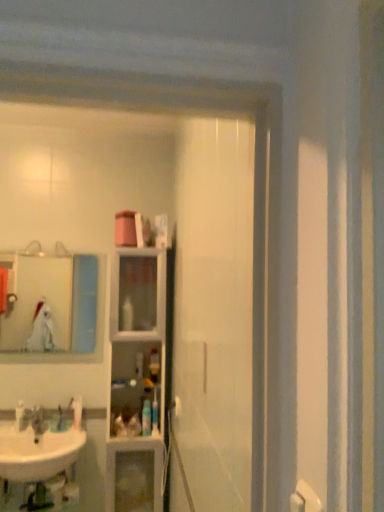
In the scene shown: What is the approximate height of white glossy sink at lower left?

7.51 inches.

Image resolution: width=384 pixels, height=512 pixels. What are the coordinates of `matte glass mirror at upper left` in the screenshot? It's located at (37, 300).

Consider the image. Is white glossy toothpaste tube at center, the second toiletry from the left, inside the boundaries of translucent plastic bottle at center, the 4th toiletry positioned from the left, or outside?

white glossy toothpaste tube at center, the second toiletry from the left, lies outside translucent plastic bottle at center, the 4th toiletry positioned from the left.

Based on the photo, how distant is white glossy toothpaste tube at center, the 4th toiletry when ordered from right to left, from translucent plastic bottle at center, which is the 2th toiletry in right-to-left order?

They are 19.48 inches apart.

From the image's perspective, would you say white glossy toothpaste tube at center, the 4th toiletry when ordered from right to left, is shown under translucent plastic bottle at center, which is the 2th toiletry in right-to-left order?

Yes.

Is white glossy toothpaste tube at center, the 4th toiletry when ordered from right to left, wider than translucent plastic bottle at center, the 4th toiletry positioned from the left?

In fact, white glossy toothpaste tube at center, the 4th toiletry when ordered from right to left, might be narrower than translucent plastic bottle at center, the 4th toiletry positioned from the left.

Are translucent plastic bottle at center, which ranks as the 3th toiletry in left-to-right order, and white glossy toothbrush at lower left, which ranks as the fifth toiletry in right-to-left order, far apart?

translucent plastic bottle at center, which ranks as the 3th toiletry in left-to-right order, is actually quite close to white glossy toothbrush at lower left, which ranks as the fifth toiletry in right-to-left order.

Consider the image. Who is taller, translucent plastic bottle at center, the 3th toiletry from the right, or white glossy toothbrush at lower left, which is counted as the first toiletry, starting from the left?

With more height is translucent plastic bottle at center, the 3th toiletry from the right.

From the image's perspective, which is below, translucent plastic bottle at center, the 3th toiletry from the right, or white glossy toothbrush at lower left, which ranks as the fifth toiletry in right-to-left order?

white glossy toothbrush at lower left, which ranks as the fifth toiletry in right-to-left order, from the image's perspective.

Is matte glass mirror at upper left bigger or smaller than brushed metal faucet at lower left?

matte glass mirror at upper left is bigger than brushed metal faucet at lower left.

Based on their positions, is matte glass mirror at upper left located to the left or right of brushed metal faucet at lower left?

From the image, it's evident that matte glass mirror at upper left is to the right of brushed metal faucet at lower left.

Is matte glass mirror at upper left next to brushed metal faucet at lower left and touching it?

matte glass mirror at upper left is not next to brushed metal faucet at lower left, and they're not touching.

Can you confirm if matte glass mirror at upper left is thinner than white glossy toothpaste tube at center, the 4th toiletry when ordered from right to left?

Yes, matte glass mirror at upper left is thinner than white glossy toothpaste tube at center, the 4th toiletry when ordered from right to left.

What are the coordinates of `the 4th toiletry below the matte glass mirror at upper left (from a real-world perspective)` in the screenshot? It's located at (77, 412).

How many degrees apart are the facing directions of matte glass mirror at upper left and white glossy toothpaste tube at center, the 4th toiletry when ordered from right to left?

The angular difference between matte glass mirror at upper left and white glossy toothpaste tube at center, the 4th toiletry when ordered from right to left, is 1.52 degrees.

Is matte glass mirror at upper left at the right side of white glossy toothpaste tube at center, the 4th toiletry when ordered from right to left?

No, matte glass mirror at upper left is not to the right of white glossy toothpaste tube at center, the 4th toiletry when ordered from right to left.

Identify the location of closet located on the right of white glossy toothbrush at lower left, which ranks as the fifth toiletry in right-to-left order. (136, 379).

Is white glossy toothbrush at lower left, which ranks as the fifth toiletry in right-to-left order, aimed at clear glass cabinet at center?

No.

Are white glossy toothbrush at lower left, which ranks as the fifth toiletry in right-to-left order, and clear glass cabinet at center far apart?

No, white glossy toothbrush at lower left, which ranks as the fifth toiletry in right-to-left order, is in close proximity to clear glass cabinet at center.

Which is more to the right, white glossy toothbrush at lower left, which ranks as the fifth toiletry in right-to-left order, or brushed metal faucet at lower left?

brushed metal faucet at lower left is more to the right.

Is white glossy toothbrush at lower left, which is counted as the first toiletry, starting from the left, facing towards brushed metal faucet at lower left?

No, white glossy toothbrush at lower left, which is counted as the first toiletry, starting from the left, is not aimed at brushed metal faucet at lower left.

From a real-world perspective, between white glossy toothbrush at lower left, which ranks as the fifth toiletry in right-to-left order, and brushed metal faucet at lower left, who is vertically lower?

brushed metal faucet at lower left is physically lower.

Considering the relative positions of clear glass cabinet at center and translucent plastic bottle at center, the 5th toiletry positioned from the left, in the image provided, is clear glass cabinet at center to the left or to the right of translucent plastic bottle at center, the 5th toiletry positioned from the left,?

In the image, clear glass cabinet at center appears on the left side of translucent plastic bottle at center, the 5th toiletry positioned from the left.

Choose the correct answer: Is clear glass cabinet at center inside translucent plastic bottle at center, the 5th toiletry positioned from the left, or outside it?

clear glass cabinet at center is outside translucent plastic bottle at center, the 5th toiletry positioned from the left.

Is clear glass cabinet at center aimed at translucent plastic bottle at center, the 5th toiletry positioned from the left?

Yes, clear glass cabinet at center faces towards translucent plastic bottle at center, the 5th toiletry positioned from the left.

This screenshot has width=384, height=512. Find the location of `the 2nd toiletry behind when counting from the white glossy toothpaste tube at center, the second toiletry from the left`. the 2nd toiletry behind when counting from the white glossy toothpaste tube at center, the second toiletry from the left is located at coordinates (154, 365).

This screenshot has height=512, width=384. Find the location of `toiletry that is the 2nd object directly below the translucent plastic bottle at center, which ranks as the 3th toiletry in left-to-right order (from a real-world perspective)`. toiletry that is the 2nd object directly below the translucent plastic bottle at center, which ranks as the 3th toiletry in left-to-right order (from a real-world perspective) is located at coordinates (20, 415).

Which object lies further to the anchor point translucent plastic bottle at center, the first toiletry viewed from the right, brushed metal faucet at lower left or translucent plastic bottle at center, the 4th toiletry positioned from the left?

brushed metal faucet at lower left.

From the image, which object appears to be farther from brushed metal faucet at lower left, translucent plastic bottle at center, the 4th toiletry positioned from the left, or white glossy toothpaste tube at center, the 4th toiletry when ordered from right to left?

Among the two, translucent plastic bottle at center, the 4th toiletry positioned from the left, is located further to brushed metal faucet at lower left.

Considering their positions, is clear glass cabinet at center positioned further to white glossy sink at lower left than translucent plastic bottle at center, the 4th toiletry positioned from the left?

Among the two, translucent plastic bottle at center, the 4th toiletry positioned from the left, is located further to white glossy sink at lower left.

Looking at the image, which one is located further to white glossy sink at lower left, translucent plastic bottle at center, the 5th toiletry positioned from the left, or white glossy toothbrush at lower left, which ranks as the fifth toiletry in right-to-left order?

Based on the image, translucent plastic bottle at center, the 5th toiletry positioned from the left, appears to be further to white glossy sink at lower left.

Estimate the real-world distances between objects in this image. Which object is further from translucent plastic bottle at center, the 4th toiletry positioned from the left, clear glass cabinet at center or matte glass mirror at upper left?

matte glass mirror at upper left is positioned further to the anchor translucent plastic bottle at center, the 4th toiletry positioned from the left.

Consider the image. Considering their positions, is matte glass mirror at upper left positioned further to translucent plastic bottle at center, which ranks as the 3th toiletry in left-to-right order, than white glossy toothbrush at lower left, which is counted as the first toiletry, starting from the left?

matte glass mirror at upper left lies further to translucent plastic bottle at center, which ranks as the 3th toiletry in left-to-right order, than the other object.

Estimate the real-world distances between objects in this image. Which object is further from translucent plastic bottle at center, the 5th toiletry positioned from the left, brushed metal faucet at lower left or white glossy toothbrush at lower left, which ranks as the fifth toiletry in right-to-left order?

white glossy toothbrush at lower left, which ranks as the fifth toiletry in right-to-left order, is further to translucent plastic bottle at center, the 5th toiletry positioned from the left.

Based on their spatial positions, is brushed metal faucet at lower left or clear glass cabinet at center closer to translucent plastic bottle at center, the 5th toiletry positioned from the left?

Among the two, clear glass cabinet at center is located nearer to translucent plastic bottle at center, the 5th toiletry positioned from the left.

You are a GUI agent. You are given a task and a screenshot of the screen. Output one action in this format:
    pyautogui.click(x=<x>, y=<y>)
    Task: Click on the sink located between brushed metal faucet at lower left and translucent plastic bottle at center, the 3th toiletry from the right, in the left-right direction
    
    Given the screenshot: What is the action you would take?
    click(x=37, y=452)

Find the location of a particular element. This screenshot has height=512, width=384. closet between white glossy toothpaste tube at center, the 4th toiletry when ordered from right to left, and translucent plastic bottle at center, the 4th toiletry positioned from the left, in the horizontal direction is located at coordinates (136, 379).

Find the location of `faucet located between white glossy sink at lower left and white glossy toothpaste tube at center, the 4th toiletry when ordered from right to left, in the depth direction`. faucet located between white glossy sink at lower left and white glossy toothpaste tube at center, the 4th toiletry when ordered from right to left, in the depth direction is located at coordinates pos(37,422).

Where is `sink located between brushed metal faucet at lower left and translucent plastic bottle at center, the first toiletry viewed from the right, in the left-right direction`? This screenshot has width=384, height=512. sink located between brushed metal faucet at lower left and translucent plastic bottle at center, the first toiletry viewed from the right, in the left-right direction is located at coordinates (37, 452).